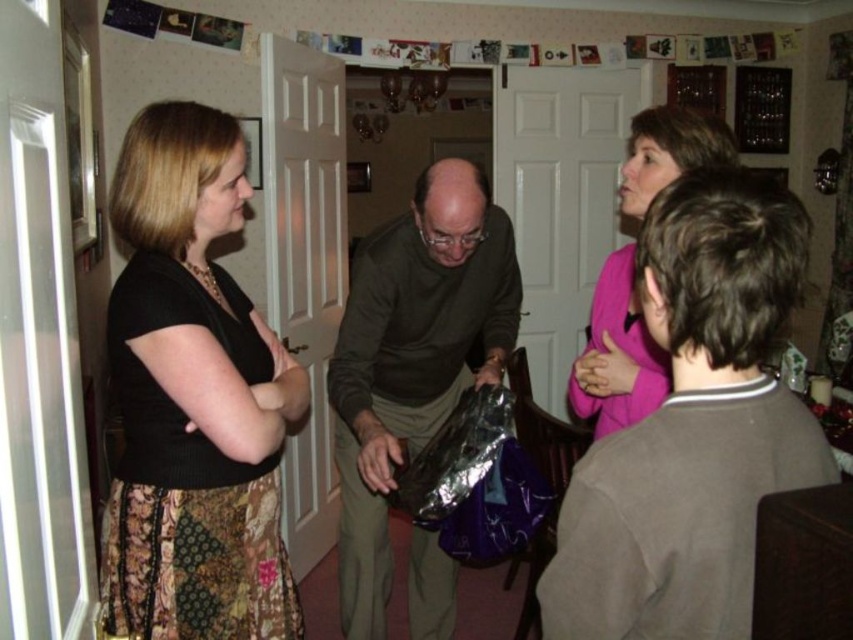
Between matte green sweater at center and pink matte sweater at upper right, which one is positioned lower?

matte green sweater at center is lower down.

Which of these two, matte green sweater at center or pink matte sweater at upper right, stands shorter?

pink matte sweater at upper right is shorter.

Where is `matte green sweater at center`? This screenshot has height=640, width=853. matte green sweater at center is located at coordinates (412, 356).

Locate an element on the screen. matte green sweater at center is located at coordinates (412, 356).

Is point (152, 188) positioned before point (695, 128)?

Yes, point (152, 188) is closer to viewer.

Is black textured sweater at left further to camera compared to pink matte sweater at upper right?

No.

This screenshot has width=853, height=640. Find the location of `black textured sweater at left`. black textured sweater at left is located at coordinates (193, 397).

Image resolution: width=853 pixels, height=640 pixels. I want to click on black textured sweater at left, so click(193, 397).

Is black textured sweater at left bigger than matte green sweater at center?

No, black textured sweater at left is not bigger than matte green sweater at center.

How far apart are black textured sweater at left and matte green sweater at center?

black textured sweater at left and matte green sweater at center are 19.71 inches apart.

Which is behind, point (196, 435) or point (486, 355)?

Point (486, 355)

Identify the location of black textured sweater at left. (193, 397).